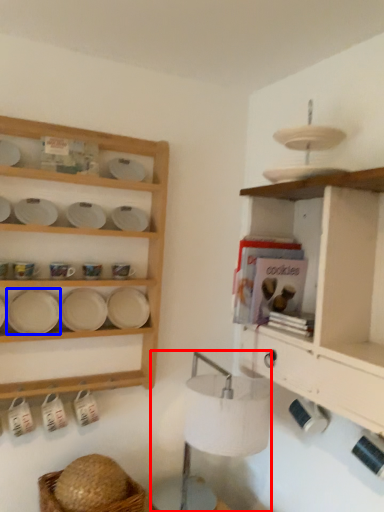
Question: Which object is closer to the camera taking this photo, lamp (highlighted by a red box) or platter (highlighted by a blue box)?

Choices:
 (A) lamp
 (B) platter

Answer: (A)